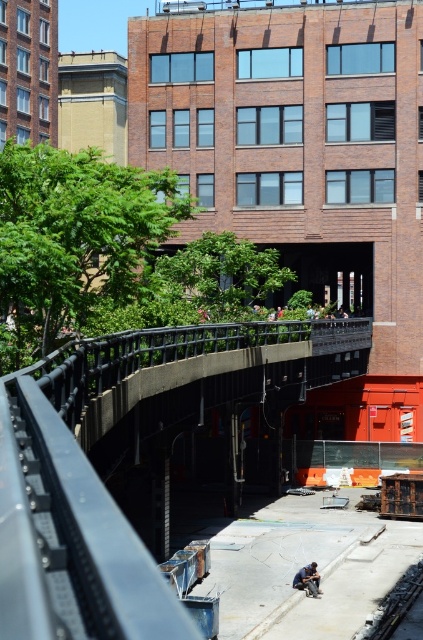
Does concrete sidewalk at center have a lesser width compared to blue jeans construction worker at lower center?

No.

Does concrete sidewalk at center have a smaller size compared to blue jeans construction worker at lower center?

A: No, concrete sidewalk at center is not smaller than blue jeans construction worker at lower center.

Image resolution: width=423 pixels, height=640 pixels. In order to click on concrete sidewalk at center in this screenshot , I will do pyautogui.click(x=117, y=458).